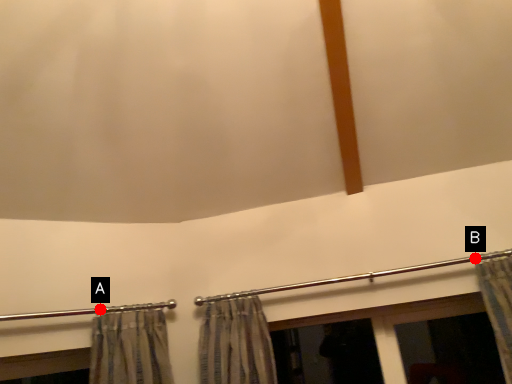
Question: Two points are circled on the image, labeled by A and B beside each circle. Among these points, which one is farthest from the camera?

Choices:
 (A) A is further
 (B) B is further

Answer: (B)